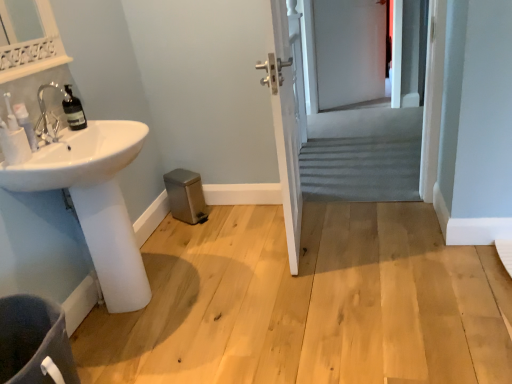
Question: Choose the correct answer: Is matte white soap dispenser at left inside white glossy sink at lower left or outside it?

Choices:
 (A) outside
 (B) inside

Answer: (A)

Question: Considering the positions of point (19, 102) and point (102, 208), is point (19, 102) closer or farther from the camera than point (102, 208)?

Choices:
 (A) closer
 (B) farther

Answer: (A)

Question: Estimate the real-world distances between objects in this image. Which object is closer to the white wooden door at center?

Choices:
 (A) translucent glass bottle at left
 (B) white matte screen door at upper center, the second screen door from the front
 (C) white glossy sink at lower left
 (D) matte white soap dispenser at left
 (E) gray fabric screen door at center, the first screen door when ordered from front to back

Answer: (C)

Question: Which of these objects is positioned closest to the white wooden door at center?

Choices:
 (A) dark gray fabric toilet bowl at lower left
 (B) translucent glass bottle at left
 (C) matte white soap dispenser at left
 (D) white glossy sink at lower left
 (E) gray fabric screen door at center, which is the second screen door from top to bottom

Answer: (D)